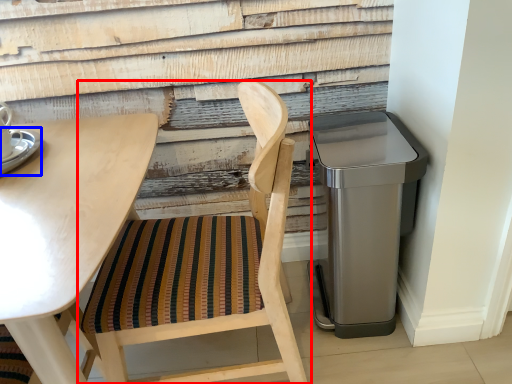
Question: Which of the following is the farthest to the observer, chair (highlighted by a red box) or saucer (highlighted by a blue box)?

Choices:
 (A) chair
 (B) saucer

Answer: (B)